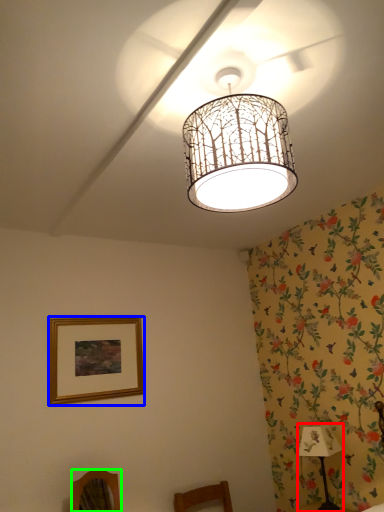
Question: Estimate the real-world distances between objects in this image. Which object is closer to table lamp (highlighted by a red box), picture frame (highlighted by a blue box) or furniture (highlighted by a green box)?

Choices:
 (A) picture frame
 (B) furniture

Answer: (B)